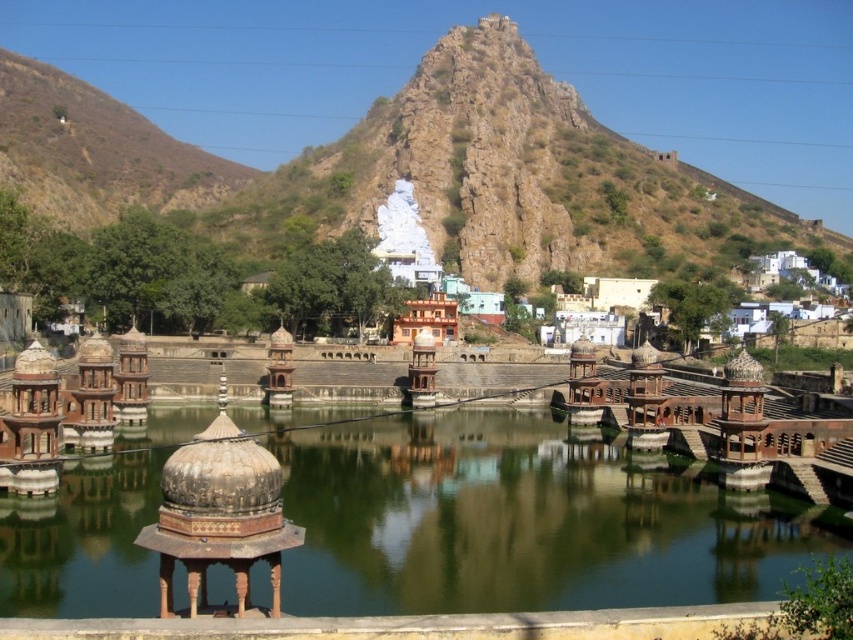
You are an architect designing a new garden layout. You have to place a statue that requires a base larger than the greenish water at center. Can the rustic stone mountain at upper center accommodate this statue?

The rustic stone mountain at upper center has a larger size compared to the greenish water at center, so it can accommodate the statue requiring a base larger than the greenish water at center.

You are standing at the edge of the greenish water at center and want to reach the rustic stone mountain at upper center. Which direction should you head towards?

The rustic stone mountain at upper center is to the left of greenish water at center, so you should head towards the left to reach it.